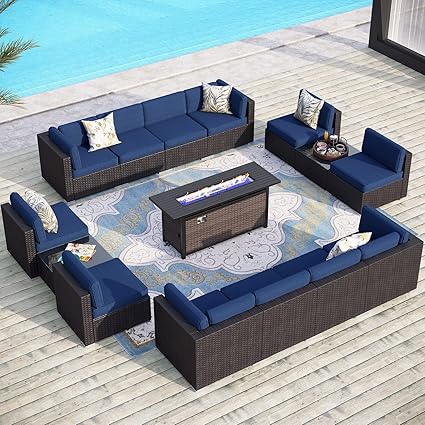
At what (x,y) coordinates should I click in order to perform the action: click on individual chair. Please return your answer as a coordinate pair (x, y). Looking at the image, I should click on (117, 279), (56, 212), (296, 127), (381, 169).